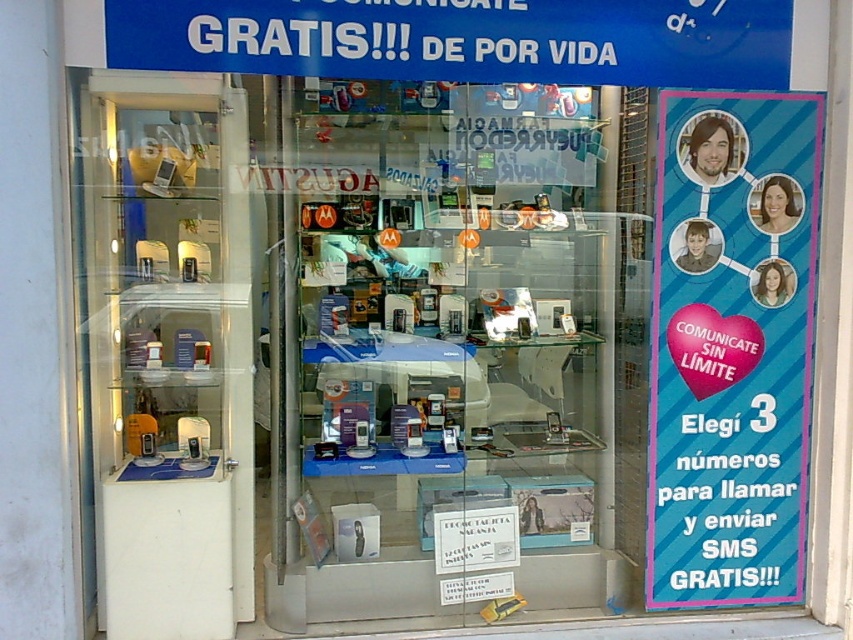
Between transparent glass display at center and blue striped poster at right, which one appears on the right side from the viewer's perspective?

From the viewer's perspective, blue striped poster at right appears more on the right side.

In the scene shown: Does transparent glass display at center have a greater width compared to blue striped poster at right?

Yes.

The image size is (853, 640). Describe the element at coordinates (444, 353) in the screenshot. I see `transparent glass display at center` at that location.

Identify the location of transparent glass display at center. The image size is (853, 640). (444, 353).